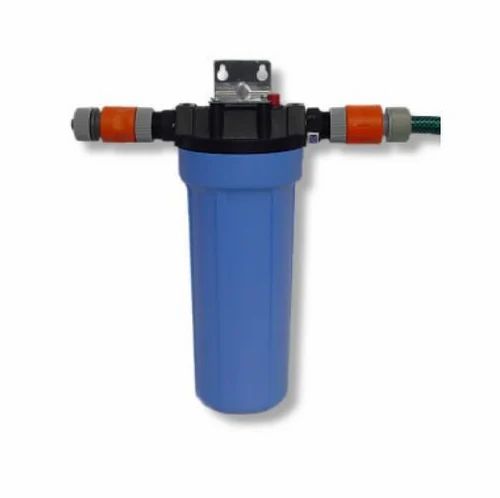
Identify the location of trash can. The height and width of the screenshot is (498, 500). (252, 312).